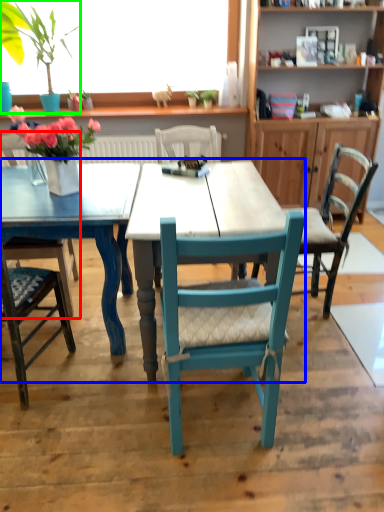
Question: Based on their relative distances, which object is farther from chair (highlighted by a red box)? Choose from kitchen & dining room table (highlighted by a blue box) and houseplant (highlighted by a green box).

Choices:
 (A) kitchen & dining room table
 (B) houseplant

Answer: (B)